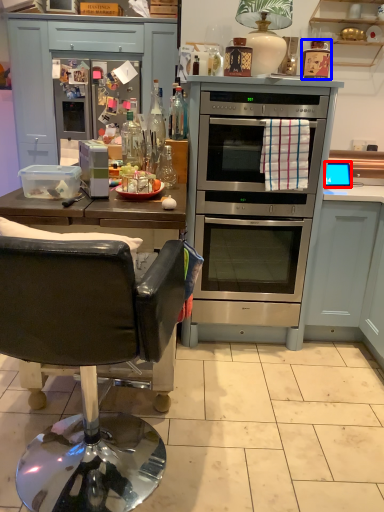
Question: Which point is further to the camera, appliance (highlighted by a red box) or appliance (highlighted by a blue box)?

Choices:
 (A) appliance
 (B) appliance

Answer: (A)